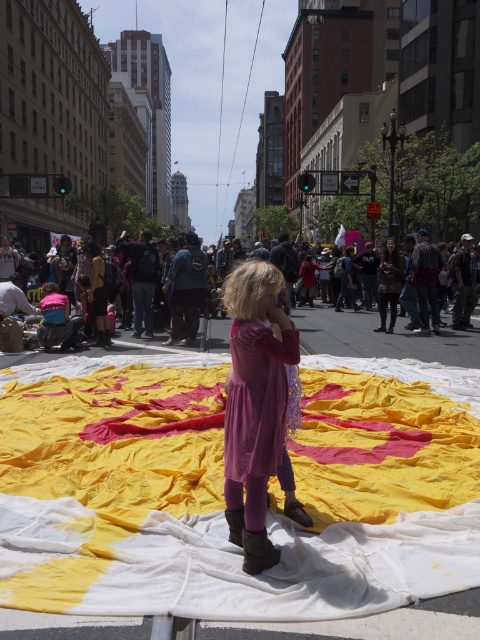
Question: Which object is closer to the camera taking this photo?

Choices:
 (A) velvet purple dress at center
 (B) yellow fabric at center
 (C) matte pink dress at center

Answer: (B)

Question: Is yellow fabric at center positioned behind matte pink dress at center?

Choices:
 (A) yes
 (B) no

Answer: (B)

Question: Is yellow fabric at center positioned behind matte pink dress at center?

Choices:
 (A) no
 (B) yes

Answer: (A)

Question: Which of the following is the closest to the observer?

Choices:
 (A) yellow fabric at center
 (B) velvet purple dress at center
 (C) matte pink dress at center

Answer: (A)

Question: Which of the following is the closest to the observer?

Choices:
 (A) (334, 323)
 (B) (384, 560)
 (C) (267, 275)

Answer: (C)

Question: Does yellow fabric at center appear on the right side of velvet purple dress at center?

Choices:
 (A) no
 (B) yes

Answer: (B)